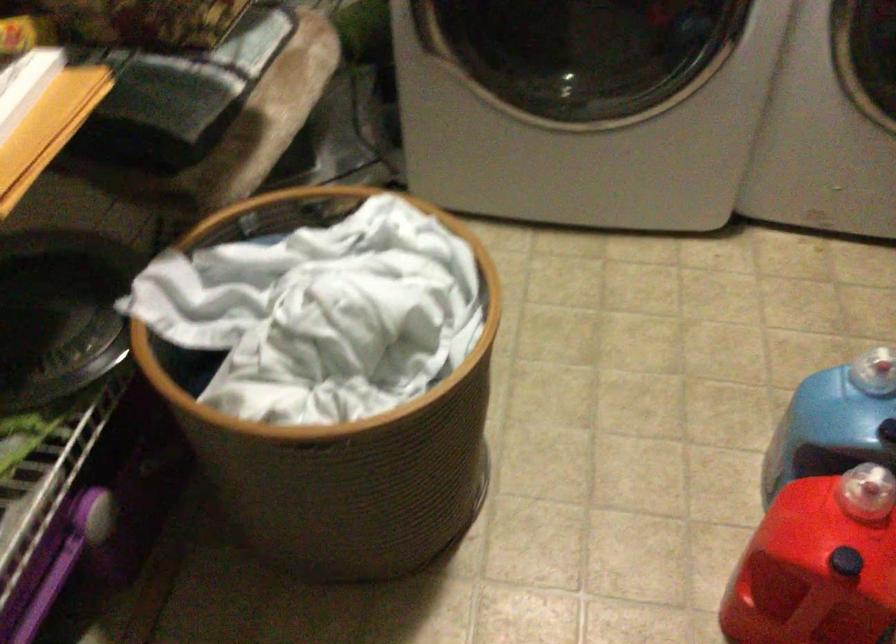
Find where to push the red container button. Please return your answer as a coordinate pair (x, y).

(846, 562)